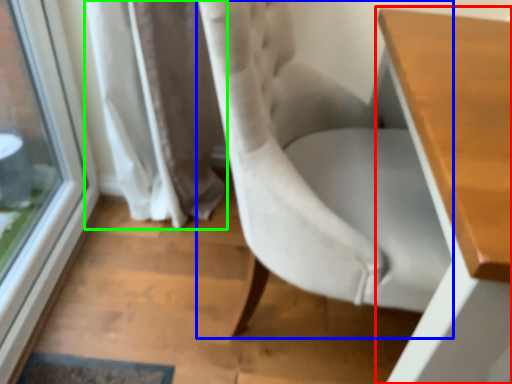
Question: Estimate the real-world distances between objects in this image. Which object is closer to table (highlighted by a red box), chair (highlighted by a blue box) or curtain (highlighted by a green box)?

Choices:
 (A) chair
 (B) curtain

Answer: (A)